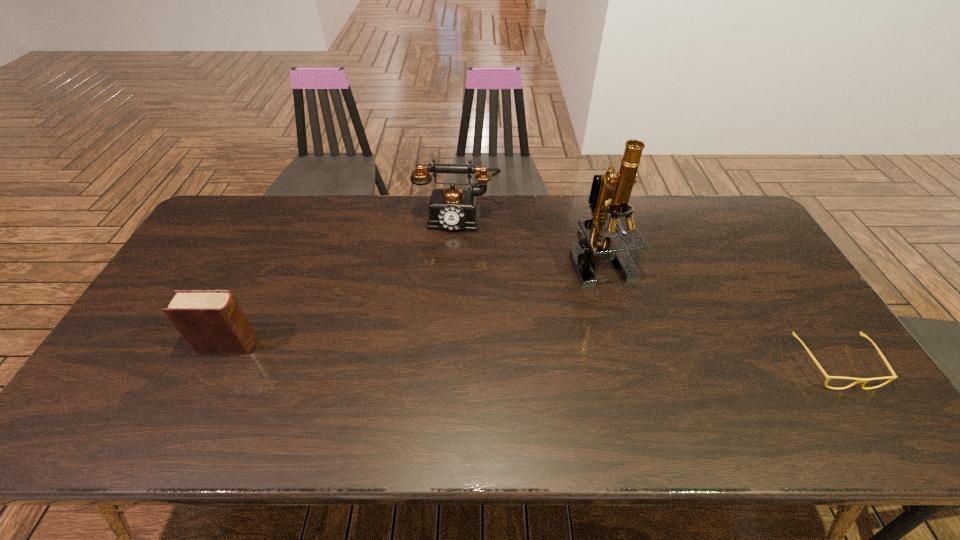
Locate an element on the screen. The image size is (960, 540). the leftmost object is located at coordinates (211, 321).

Locate an element on the screen. the third tallest object is located at coordinates [211, 321].

Locate an element on the screen. The image size is (960, 540). the shortest object is located at coordinates (864, 380).

Locate an element on the screen. Image resolution: width=960 pixels, height=540 pixels. the rightmost object is located at coordinates (864, 380).

You are a GUI agent. You are given a task and a screenshot of the screen. Output one action in this format:
    pyautogui.click(x=<x>, y=<y>)
    Task: Click on the third shortest object
    Image resolution: width=960 pixels, height=540 pixels.
    Given the screenshot: What is the action you would take?
    pyautogui.click(x=454, y=209)

Where is `the second object from left to right`? the second object from left to right is located at coordinates (454, 209).

The width and height of the screenshot is (960, 540). I want to click on the third object from left to right, so click(x=617, y=216).

Find the location of `the tallest object`. the tallest object is located at coordinates (617, 216).

Where is `vacant space positioned 0.370m on the spine side of the second shortest object`? vacant space positioned 0.370m on the spine side of the second shortest object is located at coordinates (398, 345).

At what (x,y) coordinates should I click in order to perform the action: click on free spot located 0.060m on the front of the telephone at the rotary dial. Please return your answer as a coordinate pair (x, y). Looking at the image, I should click on (452, 246).